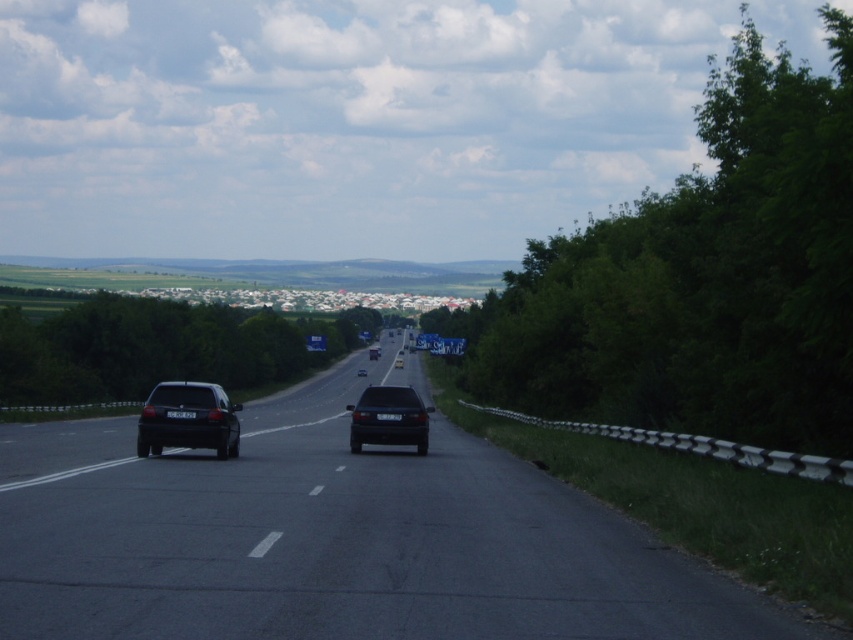
Who is lower down, satin black sedan at left or satin black sedan at center?

satin black sedan at center

Can you confirm if satin black sedan at left is smaller than satin black sedan at center?

Yes, satin black sedan at left is smaller than satin black sedan at center.

The width and height of the screenshot is (853, 640). What are the coordinates of `satin black sedan at left` in the screenshot? It's located at (189, 419).

Who is shorter, black asphalt highway at center or satin black sedan at center?

With less height is black asphalt highway at center.

Who is more distant from viewer, (415, 477) or (415, 429)?

Point (415, 429)

Locate an element on the screen. Image resolution: width=853 pixels, height=640 pixels. black asphalt highway at center is located at coordinates click(335, 540).

Is black asphalt highway at center wider than satin black sedan at left?

Yes, black asphalt highway at center is wider than satin black sedan at left.

Between black asphalt highway at center and satin black sedan at left, which one is positioned higher?

satin black sedan at left

Locate an element on the screen. black asphalt highway at center is located at coordinates (335, 540).